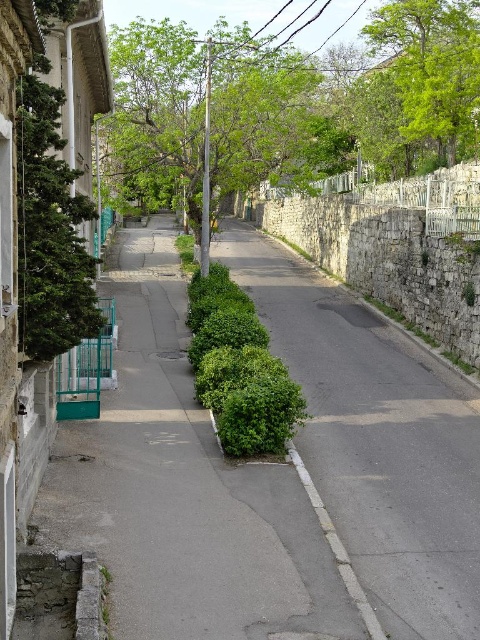
You are standing at the entrance of the street and want to walk towards the green leafy tree at upper center and the green leafy tree at upper right. Which tree will appear closer to you as you start walking forward?

The green leafy tree at upper center will appear closer to you because it is closer to the viewer than the green leafy tree at upper right.

You are a pedestrian standing at the entrance of the street. You want to walk to the end of the street. As you walk forward, will the green leafy bush at center come into your view before or after the green leafy tree at left?

The green leafy bush at center is to the right of the green leafy tree at left. Since you are walking forward along the street, the green leafy tree at left will come into view first, followed by the green leafy bush at center.